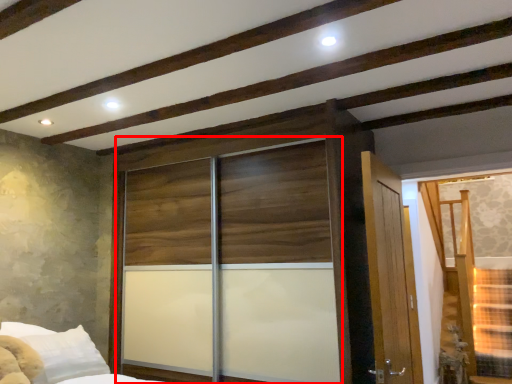
Question: Observing the image, what is the correct spatial positioning of screen door (annotated by the red box) in reference to window?

Choices:
 (A) right
 (B) left

Answer: (B)